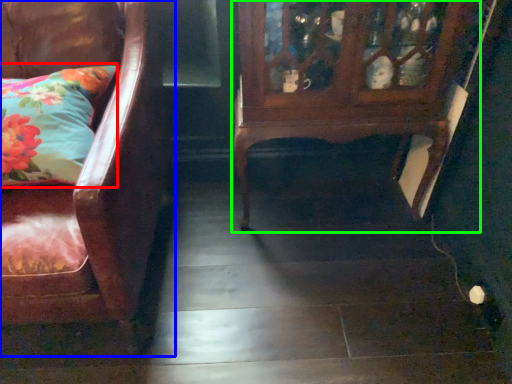
Question: Which object is positioned farthest from pillow (highlighted by a red box)? Select from chair (highlighted by a blue box) and furniture (highlighted by a green box).

Choices:
 (A) chair
 (B) furniture

Answer: (B)